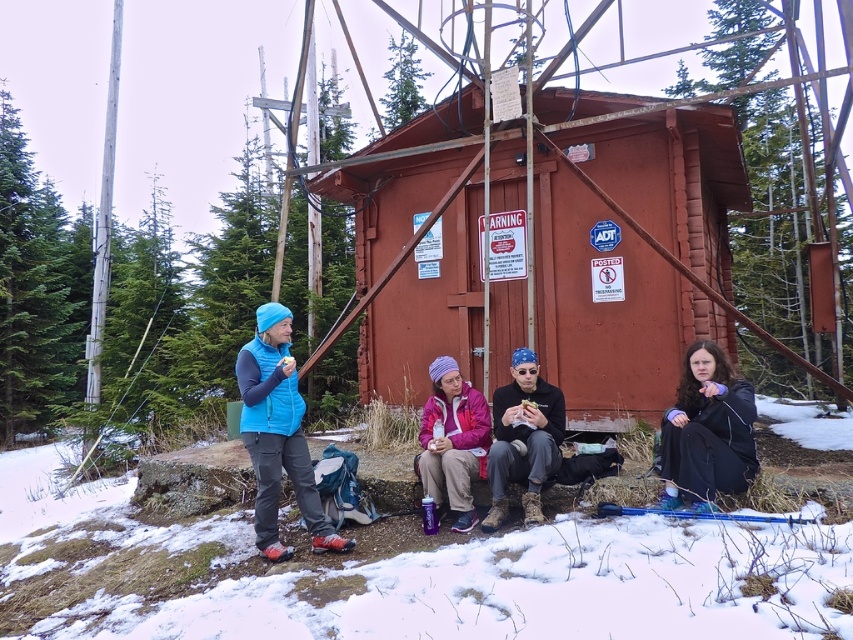
You are standing in the snowy forest and see the small red wooden structure with several signs. Where is the blue fleece vest at center located relative to the structure?

The blue fleece vest at center is located at point [277,435] relative to the structure.

You are standing in front of the small red wooden structure and see two points marked on its surface. Which point is closer to you, point (546, 285) or point (511, 458)?

Point (511, 458) is closer to you because it is less further to the camera than point (546, 285).